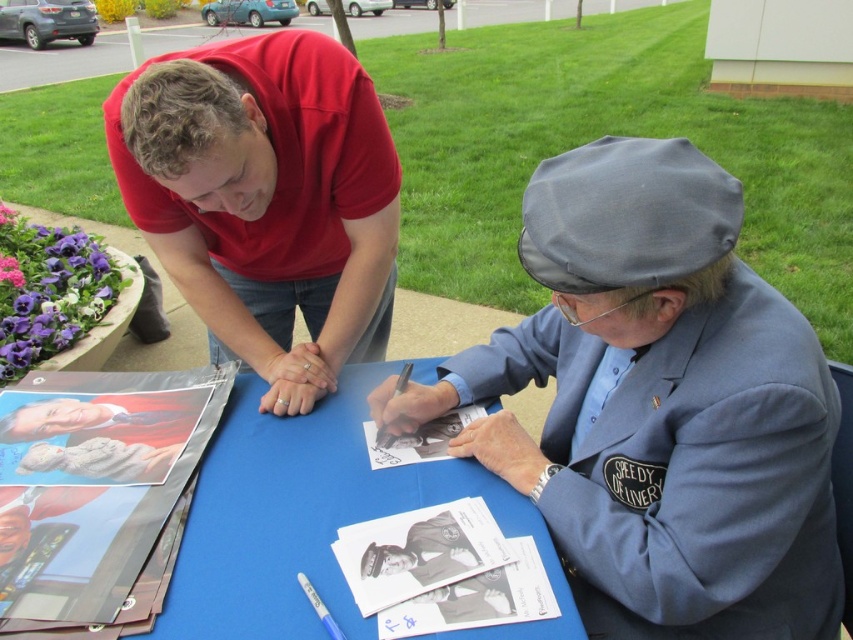
Who is more distant from viewer, (508, 460) or (149, 417)?

The point (149, 417) is more distant.

Is gray fabric cap at center positioned behind smooth glossy photo at lower left?

No, it is not.

Which is in front, point (712, 358) or point (165, 436)?

Point (712, 358)

You are a GUI agent. You are given a task and a screenshot of the screen. Output one action in this format:
    pyautogui.click(x=<x>, y=<y>)
    Task: Click on the gray fabric cap at center
    The width and height of the screenshot is (853, 640).
    Given the screenshot: What is the action you would take?
    pyautogui.click(x=659, y=404)

The width and height of the screenshot is (853, 640). What do you see at coordinates (315, 522) in the screenshot? I see `blue paper at center` at bounding box center [315, 522].

Is blue paper at center to the right of white cotton shirt at lower left from the viewer's perspective?

Indeed, blue paper at center is positioned on the right side of white cotton shirt at lower left.

Is point (265, 516) positioned behind point (54, 481)?

No, (265, 516) is closer to viewer.

Locate an element on the screen. blue paper at center is located at coordinates (315, 522).

Does gray fabric cap at center appear over red cotton shirt at upper left?

No, gray fabric cap at center is not above red cotton shirt at upper left.

Does gray fabric cap at center have a larger size compared to red cotton shirt at upper left?

No, gray fabric cap at center is not bigger than red cotton shirt at upper left.

Is point (728, 275) less distant than point (225, 116)?

Yes.

This screenshot has width=853, height=640. Find the location of `gray fabric cap at center`. gray fabric cap at center is located at coordinates (659, 404).